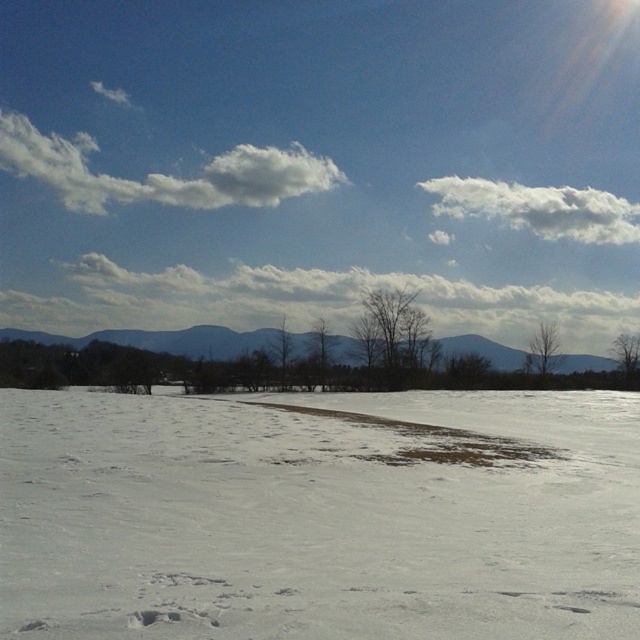
You are standing at the point closer to you in the winter landscape image. There are two points marked as point 1 at coordinates point (499, 196) and point 2 at coordinates point (236, 352). Which point are you standing at?

You are standing at point (499, 196) because it is further to the viewer than point (236, 352) according to the description.

You are an astronomer observing the sky in the winter landscape scene. You notice a significant celestial event occurring at point (538, 209). Which object in the scene is at that coordinate?

The white fluffy cloud at upper center is located at point (538, 209).

You are an explorer trying to reach the gray matte mountain at center from your current position. Based on the scene, which direction should you move relative to the white powdery snow at center to reach the mountain?

The gray matte mountain at center is located above the white powdery snow at center, so you should move upward from the white powdery snow at center to reach the gray matte mountain at center.